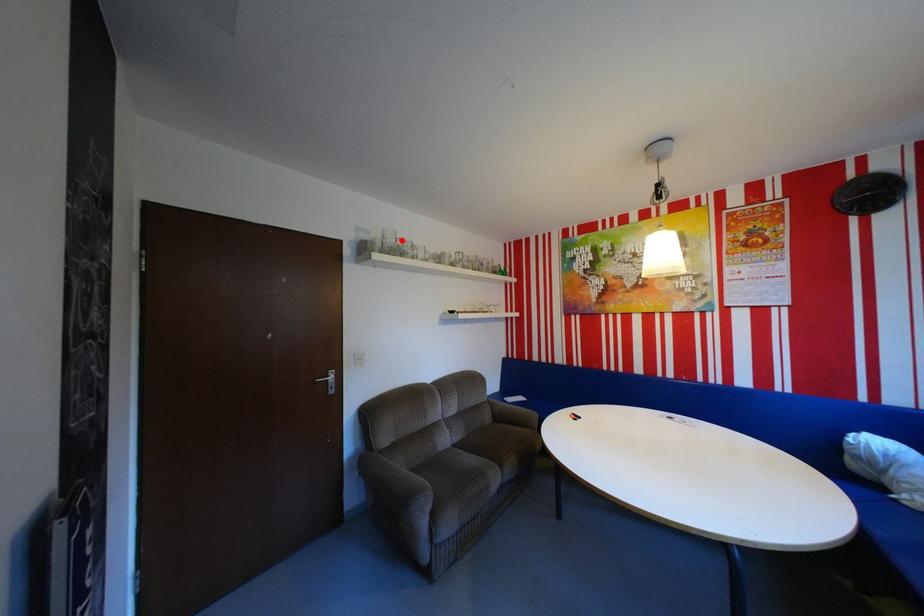
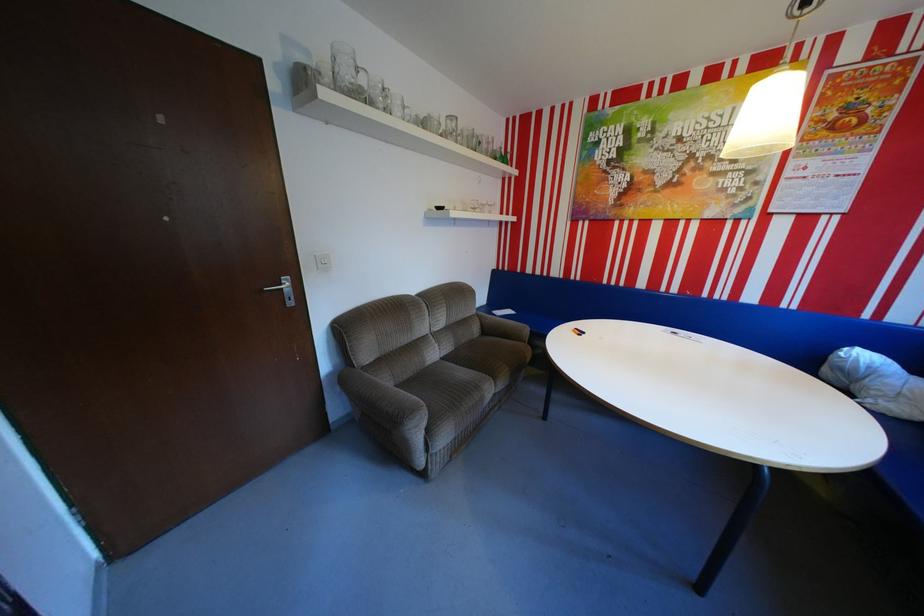
The point at the highlighted location is marked in the first image. Where is the corresponding point in the second image?

(359, 73)